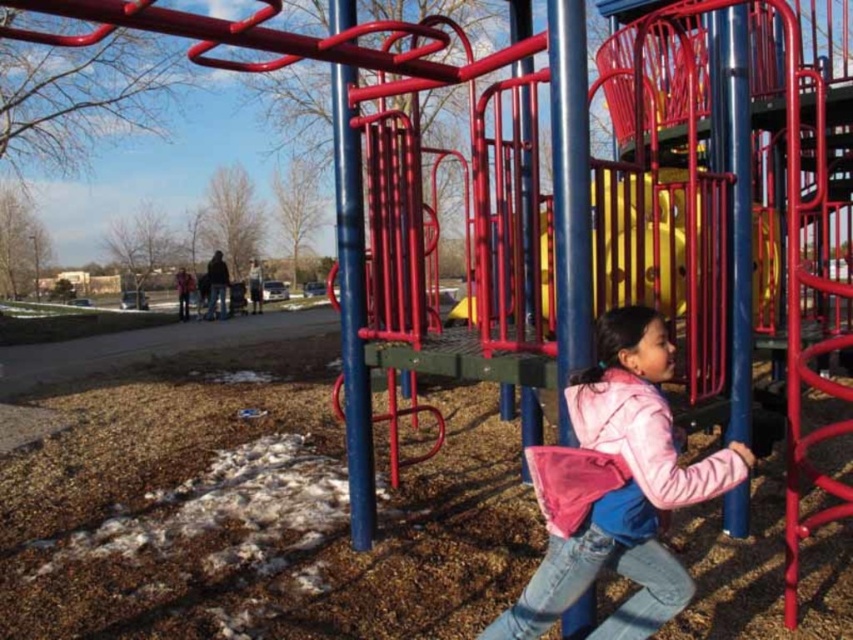
In the scene shown: You are a parent trying to locate your child in the playground. You see the pink fleece jacket at center and the yellow plastic slide at center. Which object is closer to the left side of the playground?

The pink fleece jacket at center is closer to the left side of the playground because it is positioned to the left of the yellow plastic slide at center.

You are a parent looking for your child in the playground. You remember she was wearing a pink fleece jacket. Based on the coordinates provided, where should you look to find the pink fleece jacket at center?

The pink fleece jacket at center is located at coordinates point (616, 486).

You are standing at the point marked by the coordinates point (x=616, y=486) in the playground scene. What object is located exactly at this point?

The point (x=616, y=486) marks the location of the pink fleece jacket at center.